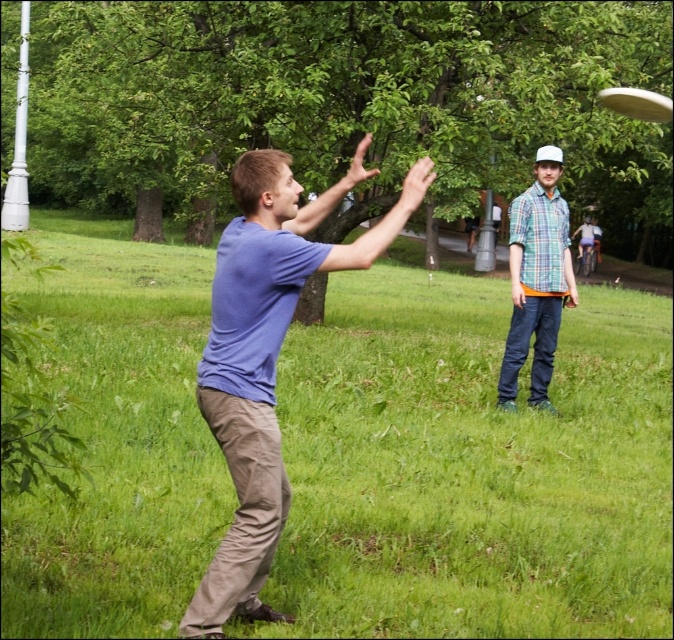
Can you confirm if blue cotton shirt at center is positioned to the left of checkered fabric shirt at upper right?

Yes, blue cotton shirt at center is to the left of checkered fabric shirt at upper right.

Is blue cotton shirt at center smaller than checkered fabric shirt at upper right?

Incorrect, blue cotton shirt at center is not smaller in size than checkered fabric shirt at upper right.

Is point (272, 524) in front of point (586, 218)?

That is True.

At what (x,y) coordinates should I click in order to perform the action: click on blue cotton shirt at center. Please return your answer as a coordinate pair (x, y). Looking at the image, I should click on (266, 355).

Based on the photo, is green grass at center to the left of white plastic frisbee at upper right from the viewer's perspective?

Yes, green grass at center is to the left of white plastic frisbee at upper right.

I want to click on green grass at center, so click(472, 467).

Locate an element on the screen. green grass at center is located at coordinates (x=472, y=467).

Is white plastic frisbee at upper right to the left of checkered fabric shirt at upper right from the viewer's perspective?

Correct, you'll find white plastic frisbee at upper right to the left of checkered fabric shirt at upper right.

Is point (661, 115) closer to viewer compared to point (594, 228)?

Yes, it is in front of point (594, 228).

Where is `white plastic frisbee at upper right`? Image resolution: width=674 pixels, height=640 pixels. white plastic frisbee at upper right is located at coordinates (636, 104).